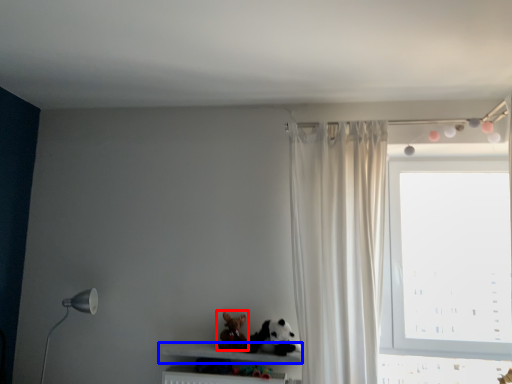
Question: Which object is further to the camera taking this photo, toy (highlighted by a red box) or shelf (highlighted by a blue box)?

Choices:
 (A) toy
 (B) shelf

Answer: (A)